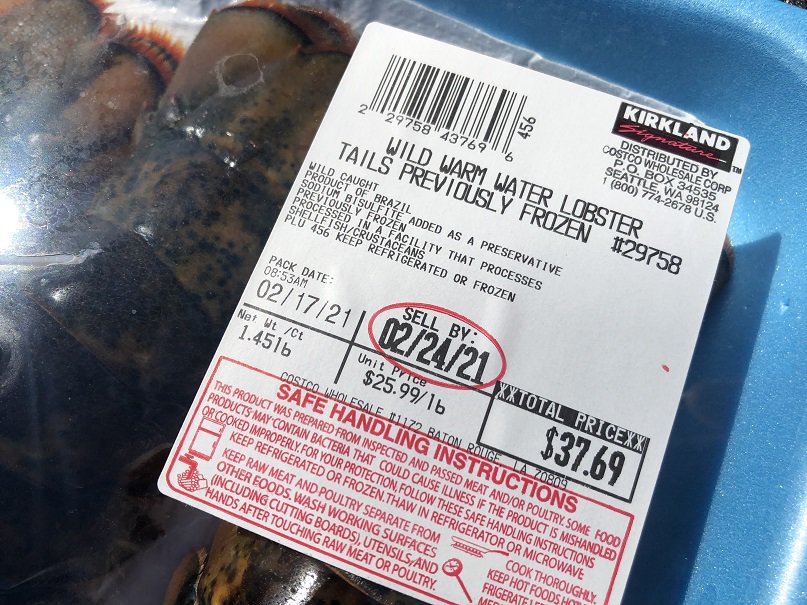
You are a GUI agent. You are given a task and a screenshot of the screen. Output one action in this format:
    pyautogui.click(x=<x>, y=<y>)
    Task: Click on the refrigerator icon
    This screenshot has width=807, height=605.
    Given the screenshot: What is the action you would take?
    pyautogui.click(x=202, y=430)